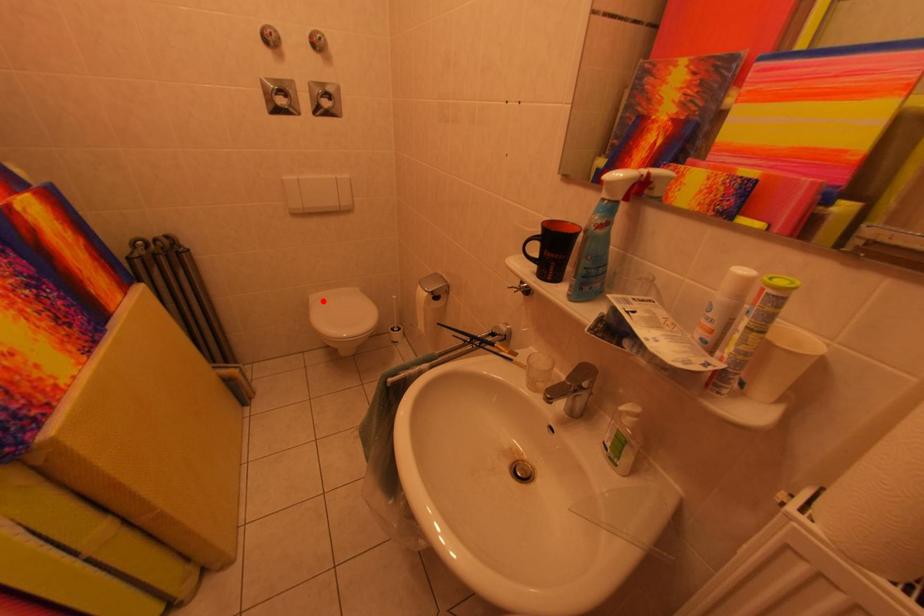
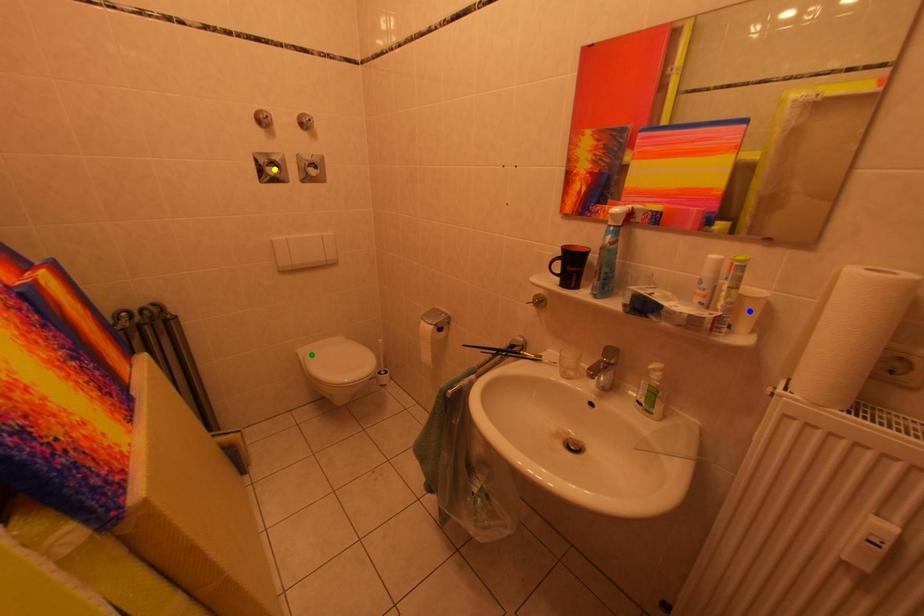
Question: I am providing you with two images of the same scene from different viewpoints. A red point is marked on the first image. You are given multiple points on the second image. Which point in image 2 represents the same 3d spot as the red point in image 1?

Choices:
 (A) blue point
 (B) green point
 (C) yellow point

Answer: (B)